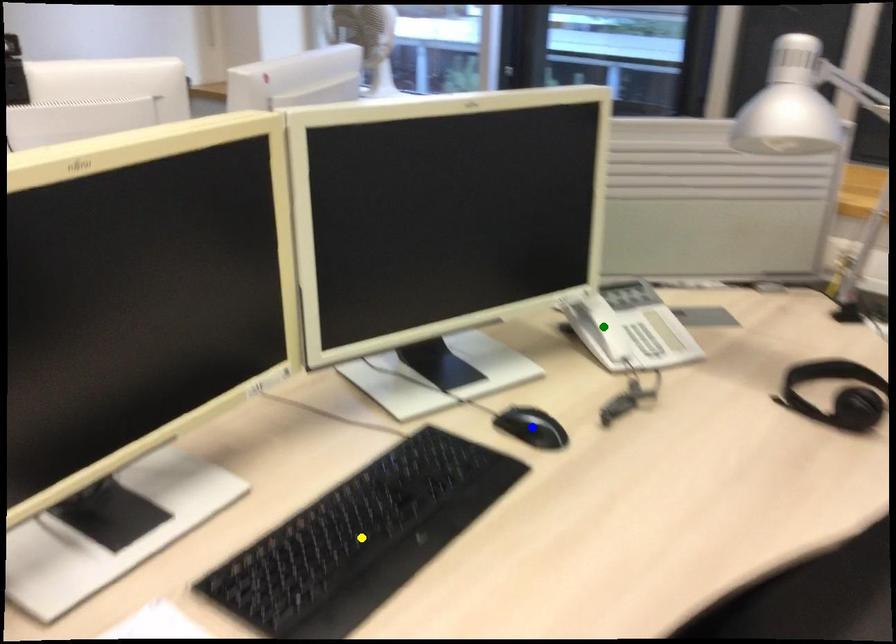
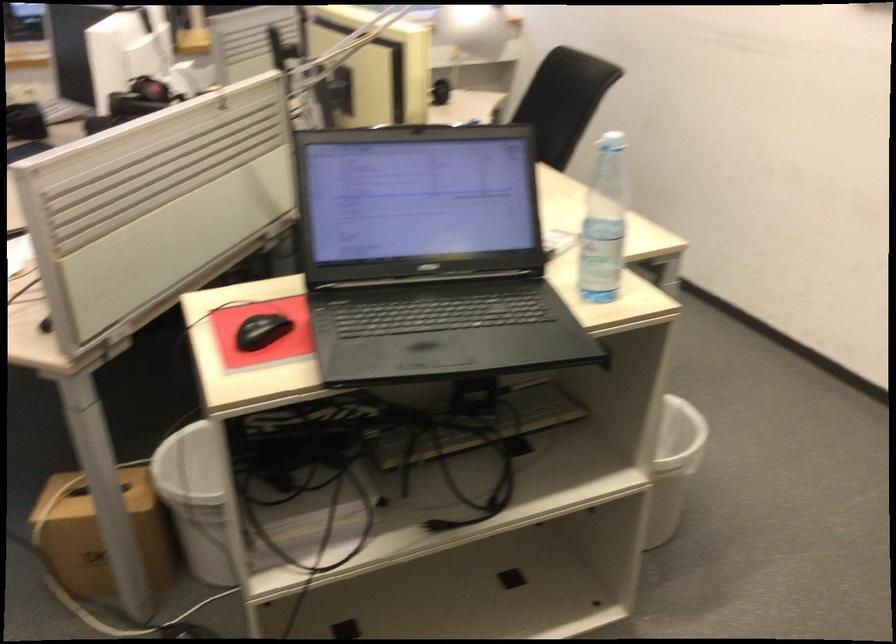
I am providing you with two images of the same scene from different viewpoints. Three points are marked in image1. Which point corresponds to a part or object that is occluded in image2?In image1, three points are marked. Which of them correspond to a part or object that is occluded in image2?Among the three points shown in image1, which one corresponds to a part or object that is no longer visible due to occlusion in image2?

green point, yellow point, blue point cannot be seen in image2.